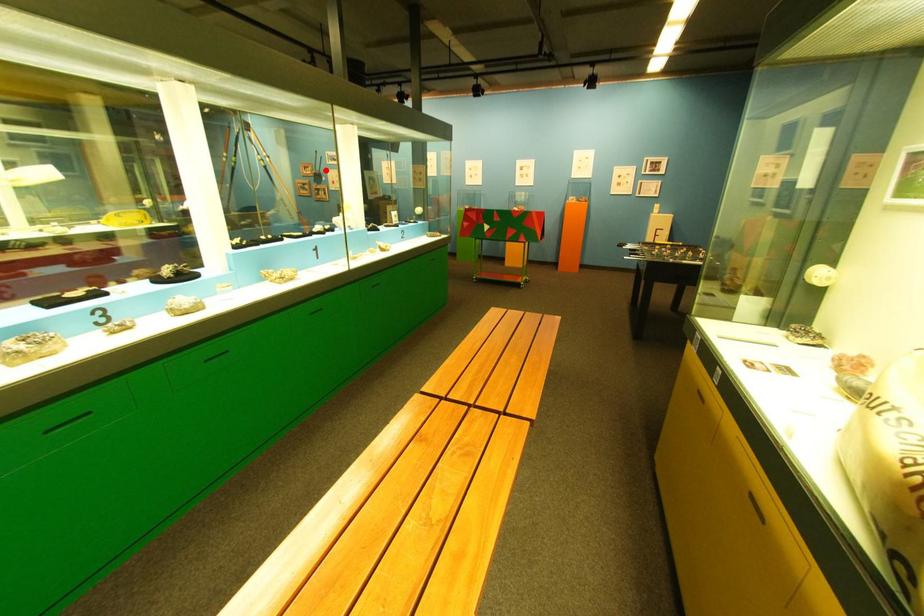
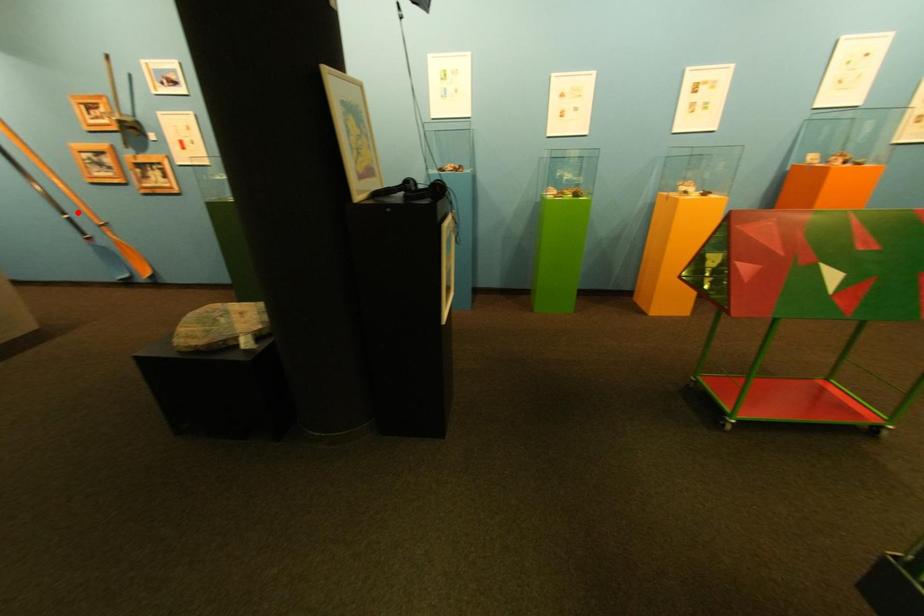
I am providing you with two images of the same scene from different viewpoints. A red point is marked on the first image and another point is marked on the second image. Do the highlighted points in image1 and image2 indicate the same real-world spot?

No